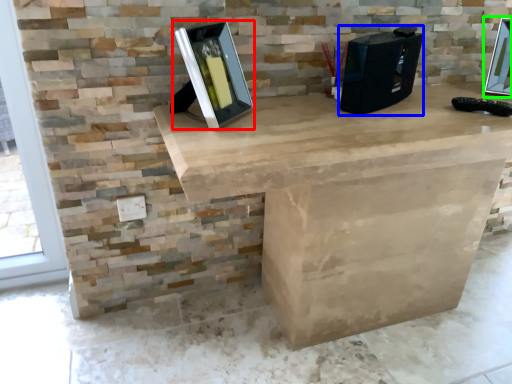
Question: Which object is positioned closest to picture frame (highlighted by a red box)? Select from desktop computer (highlighted by a blue box) and picture frame (highlighted by a green box).

Choices:
 (A) desktop computer
 (B) picture frame

Answer: (A)